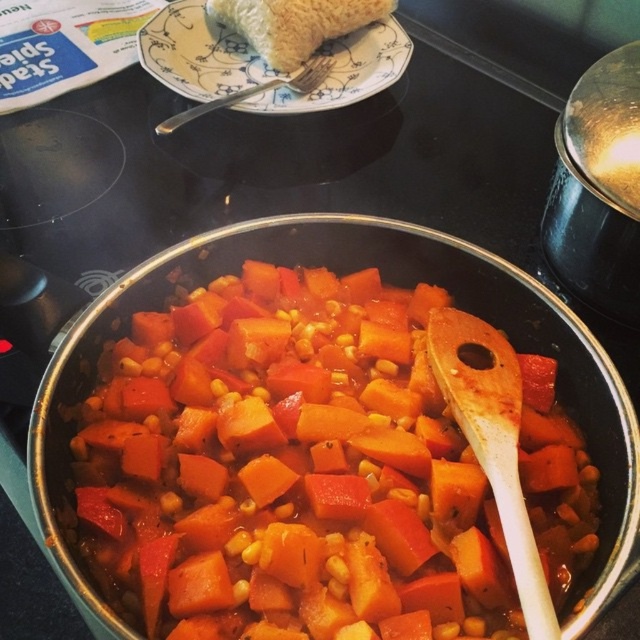
Question: Is the position of porcelain plate at upper center less distant than that of wooden spoon at center?

Choices:
 (A) yes
 (B) no

Answer: (B)

Question: Based on their relative distances, which object is nearer to the orange matte carrot at center?

Choices:
 (A) wooden spoon at center
 (B) silver metallic fork at upper center
 (C) porcelain plate at upper center

Answer: (A)

Question: Which of the following is the closest to the observer?

Choices:
 (A) orange matte carrot at center
 (B) wooden spoon at center

Answer: (B)

Question: Is the position of orange matte carrot at center less distant than that of silver metallic fork at upper center?

Choices:
 (A) yes
 (B) no

Answer: (A)

Question: Which point is farther from the camera taking this photo?

Choices:
 (A) (141, 419)
 (B) (188, 56)
 (C) (275, 86)
 (D) (490, 451)

Answer: (B)

Question: Is orange matte carrot at center further to the viewer compared to porcelain plate at upper center?

Choices:
 (A) yes
 (B) no

Answer: (B)